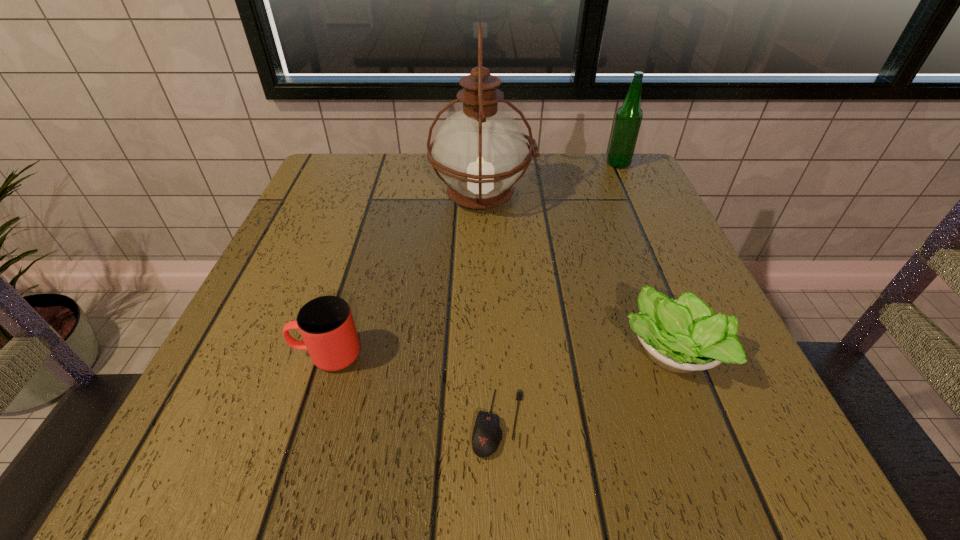
The height and width of the screenshot is (540, 960). What are the coordinates of `free location located 0.080m on the label of the farthest object` in the screenshot? It's located at (574, 164).

You are a GUI agent. You are given a task and a screenshot of the screen. Output one action in this format:
    pyautogui.click(x=<x>, y=<y>)
    Task: Click on the vacant area situated on the handle side of the leftmost object
    
    Given the screenshot: What is the action you would take?
    pyautogui.click(x=241, y=354)

Locate an element on the screen. vacant space located on the front of the second shortest object is located at coordinates (718, 472).

Image resolution: width=960 pixels, height=540 pixels. I want to click on blank space located 0.200m on the back of the shortest object, so click(x=494, y=291).

Locate an element on the screen. oil lamp present at the far edge is located at coordinates (479, 152).

You are a GUI agent. You are given a task and a screenshot of the screen. Output one action in this format:
    pyautogui.click(x=<x>, y=<y>)
    Task: Click on the beer bottle present at the far edge
    The width and height of the screenshot is (960, 540).
    Given the screenshot: What is the action you would take?
    pyautogui.click(x=629, y=116)

The image size is (960, 540). Identify the location of object situated at the near edge. (487, 434).

Locate an element on the screen. Image resolution: width=960 pixels, height=540 pixels. object at the left edge is located at coordinates click(x=326, y=324).

Where is `beer bottle at the right edge`? The image size is (960, 540). beer bottle at the right edge is located at coordinates (629, 116).

I want to click on lettuce positioned at the right edge, so click(x=682, y=336).